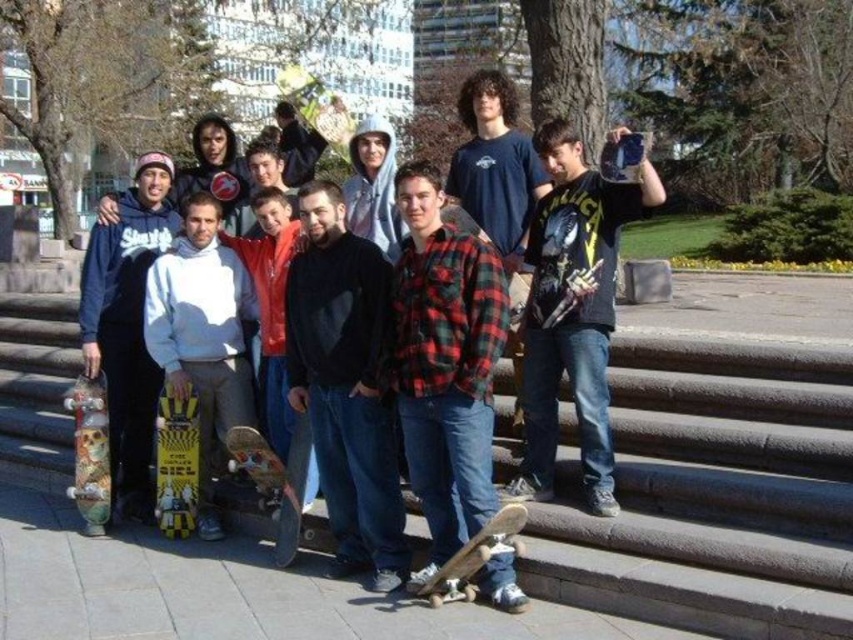
You are standing at the origin point of the coordinate system in the image. You want to move towards the black matte hoodie at center. What direction should you move in?

Since the black matte hoodie at center is located at coordinate point 0.602 on the x axis and 0.406 on the y axis, you should move northeast to reach it.

In the scene shown: You are a photographer trying to capture a candid shot of the black matte hoodie at center and the yellow and black graphic skateboard at center. Since you want the skateboard to appear to the left of the hoodie in the photo, does the current arrangement allow this?

Yes, the current arrangement allows the skateboard to appear to the left of the hoodie in the photo because the black matte hoodie at center is to the right of the yellow and black graphic skateboard at center.

You are standing at the bottom of the stone steps where the group is posing. You want to walk towards the point that is closer to you. Which point should you head towards, point (85, 416) or point (476, 532)?

You should head towards point (476, 532) because it is closer to you than point (85, 416), which is further away.